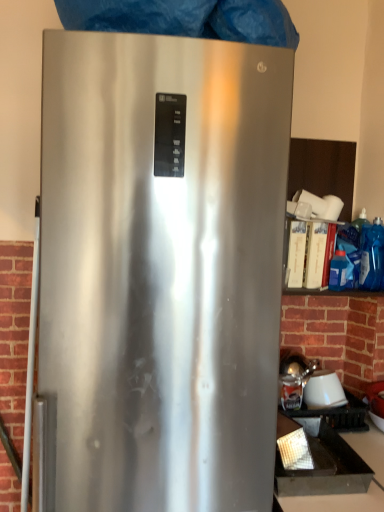
Question: From the image's perspective, relative to satin silver refrigerator at center, is brickwork at left above or below?

Choices:
 (A) below
 (B) above

Answer: (A)

Question: In terms of size, does brickwork at left appear bigger or smaller than satin silver refrigerator at center?

Choices:
 (A) big
 (B) small

Answer: (B)

Question: Which object is the farthest from the white glossy lampshade at lower right?

Choices:
 (A) satin silver refrigerator at center
 (B) blue plastic bag at right
 (C) brickwork at left
 (D) black matte tray at lower right

Answer: (C)

Question: Based on their relative distances, which object is farther from the blue plastic bag at right?

Choices:
 (A) white glossy lampshade at lower right
 (B) brickwork at left
 (C) satin silver refrigerator at center
 (D) black matte tray at lower right

Answer: (B)